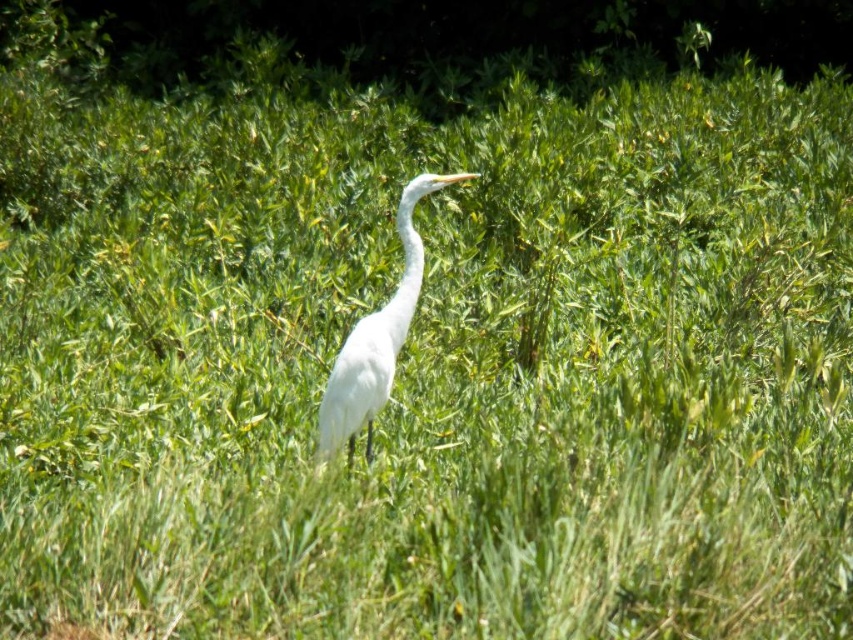
Is white smooth heron at center smaller than white smooth neck at center?

No.

Can you confirm if white smooth heron at center is bigger than white smooth neck at center?

Yes.

Is point (408, 182) behind point (395, 317)?

Yes, point (408, 182) is behind point (395, 317).

The width and height of the screenshot is (853, 640). Identify the location of white smooth heron at center. (376, 339).